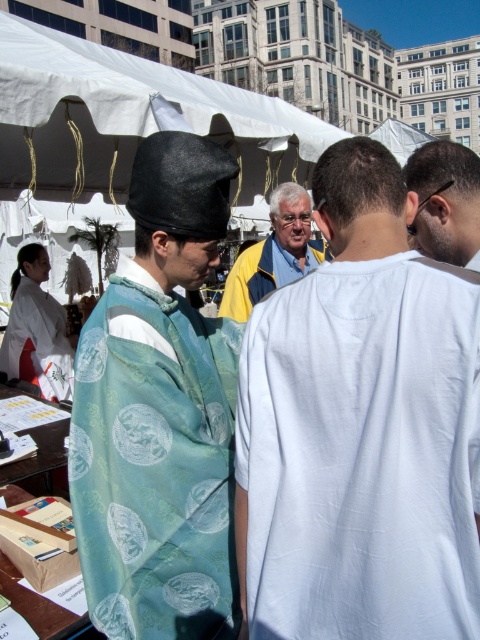
Is point (468, 196) positioned after point (45, 291)?

No, (468, 196) is closer to viewer.

Which is more to the right, sunglasses at upper right or light blue silk kimono at left?

sunglasses at upper right

This screenshot has width=480, height=640. What are the coordinates of `sunglasses at upper right` in the screenshot? It's located at pos(445,202).

I want to click on sunglasses at upper right, so (x=445, y=202).

Between white cotton shirt at center and silk kimono at center, which one has less height?

Standing shorter between the two is white cotton shirt at center.

Does point (276, 560) lie in front of point (180, 320)?

Yes, point (276, 560) is closer to viewer.

Which is in front, point (468, 292) or point (145, 138)?

Point (468, 292) is in front.

The height and width of the screenshot is (640, 480). Identify the location of white cotton shirt at center. (360, 428).

Who is taller, silk kimono at center or blue fabric shirt at center?

Standing taller between the two is silk kimono at center.

Between silk kimono at center and blue fabric shirt at center, which one is positioned higher?

blue fabric shirt at center is above.

I want to click on silk kimono at center, so click(158, 406).